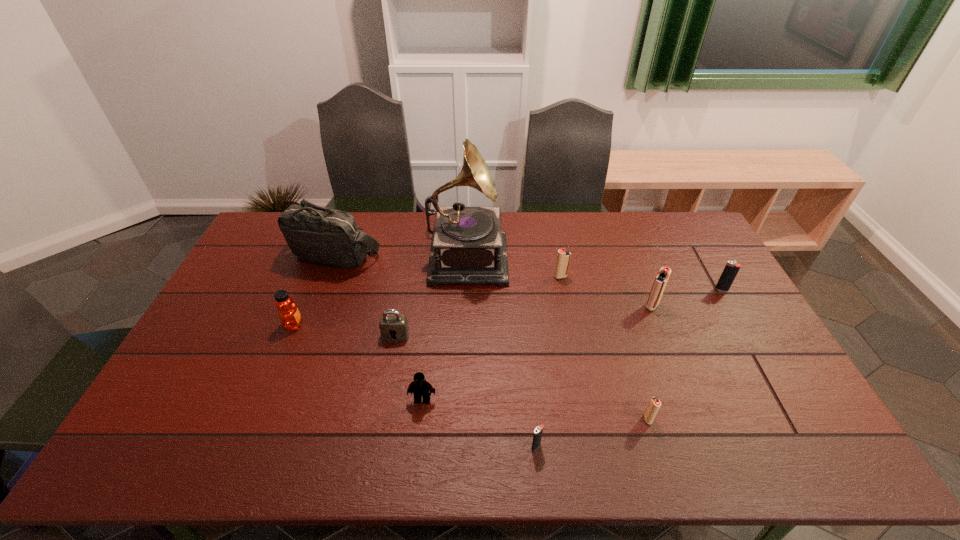
The image size is (960, 540). Find the location of `padlock`. padlock is located at coordinates (393, 326).

This screenshot has width=960, height=540. What are the coordinates of `the third nearest object` in the screenshot? It's located at (421, 387).

Identify the location of Lego. Image resolution: width=960 pixels, height=540 pixels. (421, 387).

Locate an element on the screen. The width and height of the screenshot is (960, 540). the second nearest igniter is located at coordinates (655, 403).

Where is `the third object from right to left`? the third object from right to left is located at coordinates (655, 403).

Locate an element on the screen. This screenshot has height=540, width=960. the fifth object from right to left is located at coordinates (538, 431).

The height and width of the screenshot is (540, 960). Find the location of `the left black igniter`. the left black igniter is located at coordinates (538, 431).

In order to click on vacant point located on the horn of the golden record player in this screenshot , I will do `click(554, 253)`.

You are a GUI agent. You are given a task and a screenshot of the screen. Output one action in this format:
    pyautogui.click(x=<x>, y=<y>)
    Task: Click on the free space located at the front padded panel of the shoulder bag
    
    Given the screenshot: What is the action you would take?
    pyautogui.click(x=322, y=293)

Locate an element on the screen. The image size is (960, 540). vacant area situated 0.250m on the left of the fifth farthest object is located at coordinates (565, 306).